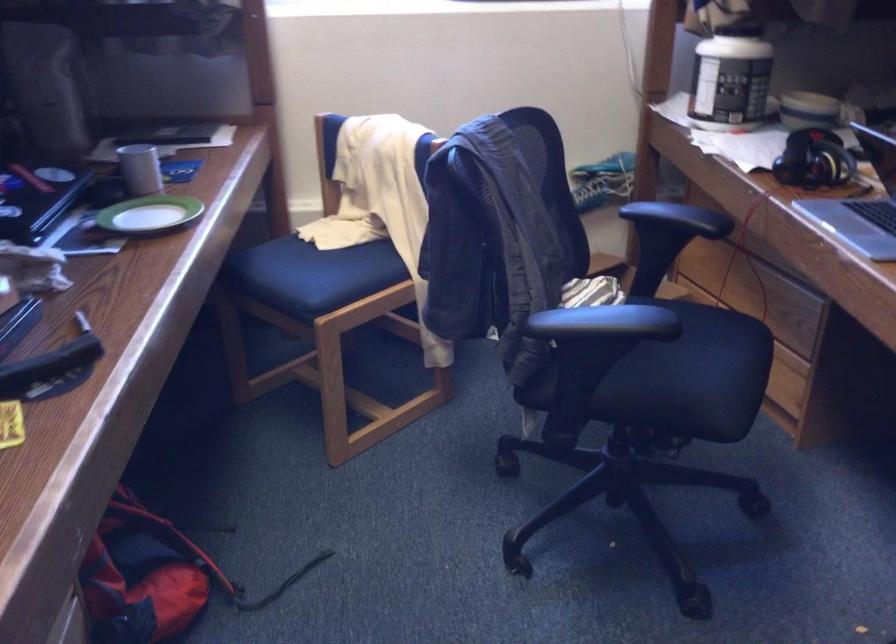
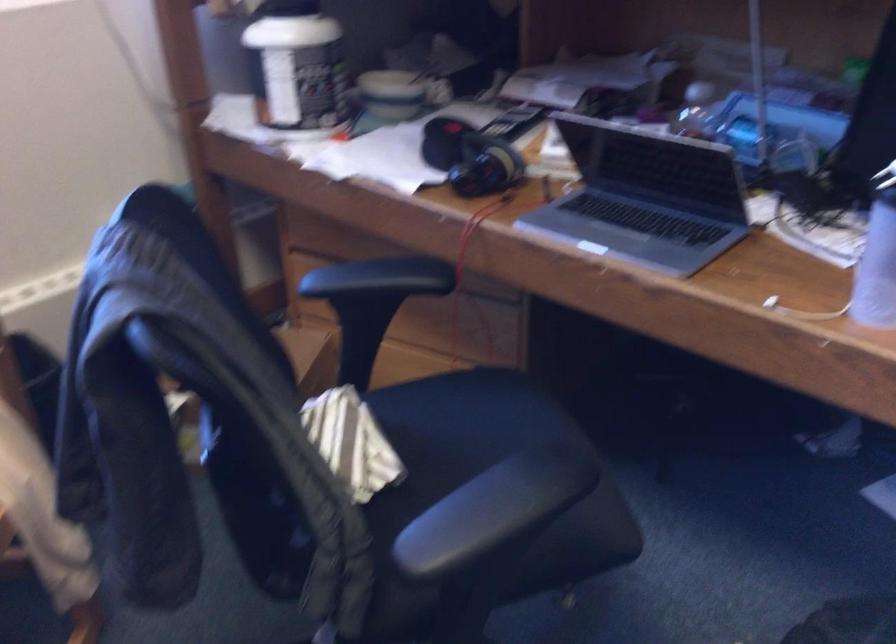
Question: The camera is either moving clockwise (left) or counter-clockwise (right) around the object. The first image is from the beginning of the video and the second image is from the end. Is the camera moving left or right when shooting the video?

Choices:
 (A) Left
 (B) Right

Answer: (A)